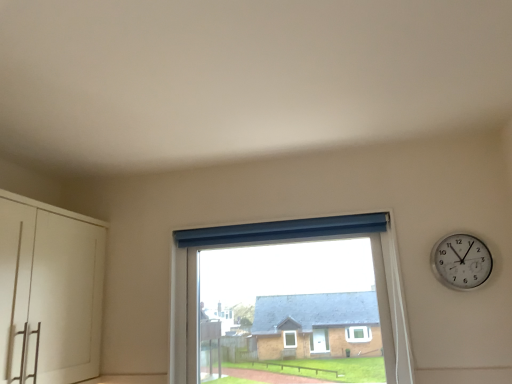
The width and height of the screenshot is (512, 384). What are the coordinates of `white matte cabinet at left` in the screenshot? It's located at (49, 292).

The image size is (512, 384). What do you see at coordinates (49, 292) in the screenshot? I see `white matte cabinet at left` at bounding box center [49, 292].

Identify the location of silver metallic wall clock at upper right. (461, 261).

Could you measure the distance between silver metallic wall clock at upper right and transparent glass window at center?

silver metallic wall clock at upper right is 17.88 inches away from transparent glass window at center.

Is silver metallic wall clock at upper right shorter than transparent glass window at center?

Yes, silver metallic wall clock at upper right is shorter than transparent glass window at center.

Is point (484, 253) closer or farther from the camera than point (394, 280)?

Point (484, 253).

Find the location of `window below the silver metallic wall clock at upper right (from the image's perspective)`. window below the silver metallic wall clock at upper right (from the image's perspective) is located at coordinates (291, 241).

Between transparent glass window at center and white matte cabinet at left, which one has smaller width?

transparent glass window at center is thinner.

How many degrees apart are the facing directions of transparent glass window at center and white matte cabinet at left?

transparent glass window at center and white matte cabinet at left are facing 90.7 degrees away from each other.

Which point is more forward, (348,233) or (56,208)?

The point (56,208) is in front.

Is the position of transparent glass window at center more distant than that of white matte cabinet at left?

Yes, transparent glass window at center is further from the camera.

Based on the photo, is silver metallic wall clock at upper right at the back of white matte cabinet at left?

That's not correct — white matte cabinet at left is not looking away from silver metallic wall clock at upper right.

From a real-world perspective, does white matte cabinet at left sit lower than silver metallic wall clock at upper right?

Indeed, from a real-world perspective, white matte cabinet at left is positioned beneath silver metallic wall clock at upper right.

Image resolution: width=512 pixels, height=384 pixels. What are the coordinates of `dresser below the silver metallic wall clock at upper right (from a real-world perspective)` in the screenshot? It's located at point(49,292).

In the image, is transparent glass window at center on the left side or the right side of silver metallic wall clock at upper right?

transparent glass window at center is to the left of silver metallic wall clock at upper right.

From a real-world perspective, between transparent glass window at center and silver metallic wall clock at upper right, who is vertically lower?

transparent glass window at center, from a real-world perspective.

Is silver metallic wall clock at upper right at the back of transparent glass window at center?

transparent glass window at center is not turned away from silver metallic wall clock at upper right.

From the image's perspective, does transparent glass window at center appear lower than silver metallic wall clock at upper right?

Yes, from the image's perspective, transparent glass window at center is beneath silver metallic wall clock at upper right.

Identify the location of dresser above the transparent glass window at center (from the image's perspective). (x=49, y=292).

Looking at their sizes, would you say white matte cabinet at left is wider or thinner than transparent glass window at center?

In the image, white matte cabinet at left appears to be wider than transparent glass window at center.

Are white matte cabinet at left and transparent glass window at center beside each other?

No, white matte cabinet at left is not next to transparent glass window at center.

From the image's perspective, who appears lower, white matte cabinet at left or transparent glass window at center?

transparent glass window at center, from the image's perspective.

Which of these two, silver metallic wall clock at upper right or white matte cabinet at left, is thinner?

Thinner between the two is silver metallic wall clock at upper right.

From the image's perspective, is silver metallic wall clock at upper right positioned above or below white matte cabinet at left?

Clearly, from the image's perspective, silver metallic wall clock at upper right is above white matte cabinet at left.

Measure the distance from silver metallic wall clock at upper right to white matte cabinet at left.

silver metallic wall clock at upper right and white matte cabinet at left are 5.44 feet apart from each other.

Where is `window lying below the silver metallic wall clock at upper right (from the image's perspective)`? The image size is (512, 384). window lying below the silver metallic wall clock at upper right (from the image's perspective) is located at coordinates (291, 241).

Locate an element on the screen. This screenshot has height=384, width=512. dresser above the transparent glass window at center (from a real-world perspective) is located at coordinates (x=49, y=292).

When comparing their distances from transparent glass window at center, does white matte cabinet at left or silver metallic wall clock at upper right seem further?

Among the two, white matte cabinet at left is located further to transparent glass window at center.

From the image, which object appears to be farther from transparent glass window at center, silver metallic wall clock at upper right or white matte cabinet at left?

white matte cabinet at left.

Estimate the real-world distances between objects in this image. Which object is further from silver metallic wall clock at upper right, white matte cabinet at left or transparent glass window at center?

The object further to silver metallic wall clock at upper right is white matte cabinet at left.

Which object lies nearer to the anchor point silver metallic wall clock at upper right, transparent glass window at center or white matte cabinet at left?

transparent glass window at center.

From the image, which object appears to be nearer to white matte cabinet at left, silver metallic wall clock at upper right or transparent glass window at center?

Based on the image, transparent glass window at center appears to be nearer to white matte cabinet at left.

From the image, which object appears to be nearer to white matte cabinet at left, transparent glass window at center or silver metallic wall clock at upper right?

transparent glass window at center.

The height and width of the screenshot is (384, 512). I want to click on window situated between white matte cabinet at left and silver metallic wall clock at upper right from left to right, so click(x=291, y=241).